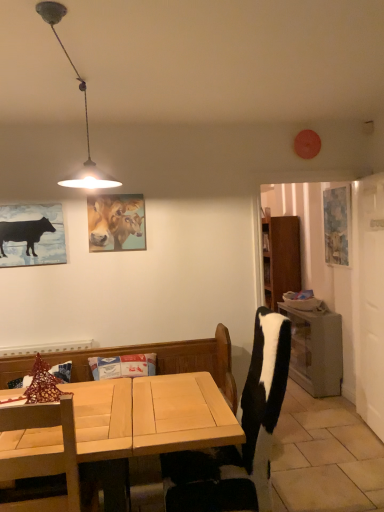
Question: Can you confirm if black matte cow at left is shorter than light wood desk at lower left?

Choices:
 (A) yes
 (B) no

Answer: (A)

Question: Is black matte cow at left bigger than light wood desk at lower left?

Choices:
 (A) yes
 (B) no

Answer: (B)

Question: Considering the relative sizes of black matte cow at left and light wood desk at lower left in the image provided, is black matte cow at left wider than light wood desk at lower left?

Choices:
 (A) no
 (B) yes

Answer: (A)

Question: Is light wood desk at lower left a part of black matte cow at left?

Choices:
 (A) no
 (B) yes

Answer: (A)

Question: Does black matte cow at left appear on the right side of light wood desk at lower left?

Choices:
 (A) no
 (B) yes

Answer: (A)

Question: Is black and white fabric chair at center, which is the 1th chair from right to left, wider or thinner than black matte cow at left?

Choices:
 (A) wide
 (B) thin

Answer: (A)

Question: Visually, is black and white fabric chair at center, which is counted as the second chair, starting from the left, positioned to the left or to the right of black matte cow at left?

Choices:
 (A) right
 (B) left

Answer: (A)

Question: In terms of size, does black and white fabric chair at center, which is counted as the second chair, starting from the left, appear bigger or smaller than black matte cow at left?

Choices:
 (A) small
 (B) big

Answer: (B)

Question: From the image's perspective, is black and white fabric chair at center, which is the 1th chair from right to left, above or below black matte cow at left?

Choices:
 (A) above
 (B) below

Answer: (B)

Question: Is wooden table at right inside the boundaries of metallic pendant light at upper left, or outside?

Choices:
 (A) inside
 (B) outside

Answer: (B)

Question: From a real-world perspective, is wooden table at right positioned above or below metallic pendant light at upper left?

Choices:
 (A) below
 (B) above

Answer: (A)

Question: Considering the positions of wooden table at right and metallic pendant light at upper left in the image, is wooden table at right bigger or smaller than metallic pendant light at upper left?

Choices:
 (A) small
 (B) big

Answer: (B)

Question: From the image's perspective, is wooden table at right positioned above or below metallic pendant light at upper left?

Choices:
 (A) below
 (B) above

Answer: (A)

Question: Is blue textured painting at right, which is counted as the 2th picture frame, starting from the front, in front of or behind metallic pendant light at upper left in the image?

Choices:
 (A) behind
 (B) front

Answer: (A)

Question: Does point (347, 197) appear closer or farther from the camera than point (57, 7)?

Choices:
 (A) closer
 (B) farther

Answer: (B)